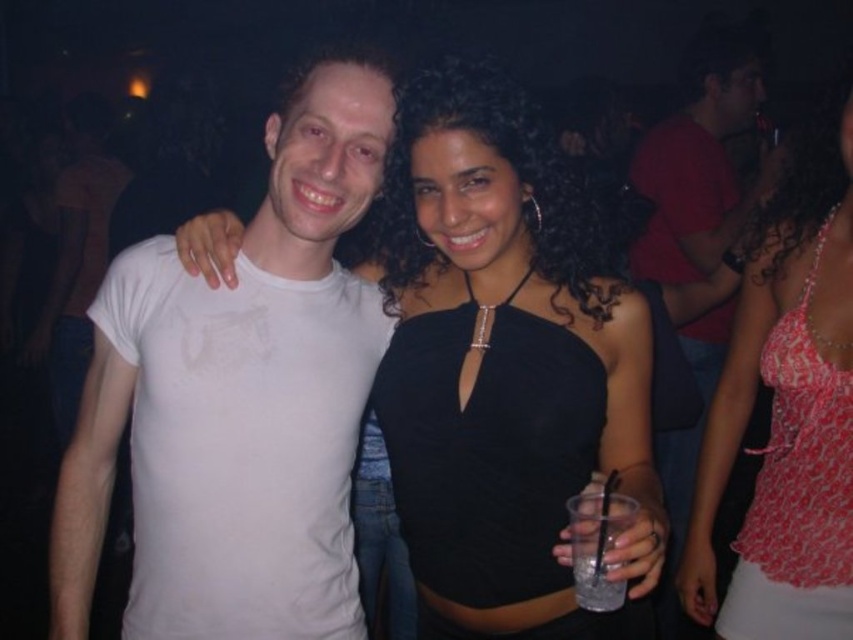
Does pink lace top at center appear over matte black shirt at upper right?

No.

Who is more forward, (799, 344) or (704, 317)?

Point (799, 344) is in front.

Is point (834, 564) in front of point (674, 252)?

Yes, it is in front of point (674, 252).

Where is `pink lace top at center`? pink lace top at center is located at coordinates (787, 424).

Does black satin dress at center have a smaller size compared to pink lace top at center?

Actually, black satin dress at center might be larger than pink lace top at center.

Can you confirm if black satin dress at center is positioned above pink lace top at center?

Indeed, black satin dress at center is positioned over pink lace top at center.

Locate an element on the screen. black satin dress at center is located at coordinates (503, 369).

In order to click on black satin dress at center in this screenshot , I will do `click(503, 369)`.

Who is more forward, (x=224, y=516) or (x=662, y=468)?

Point (x=224, y=516) is more forward.

Does white matte t-shirt at center have a greater height compared to matte black shirt at upper right?

No.

Where is `white matte t-shirt at center`? Image resolution: width=853 pixels, height=640 pixels. white matte t-shirt at center is located at coordinates (238, 401).